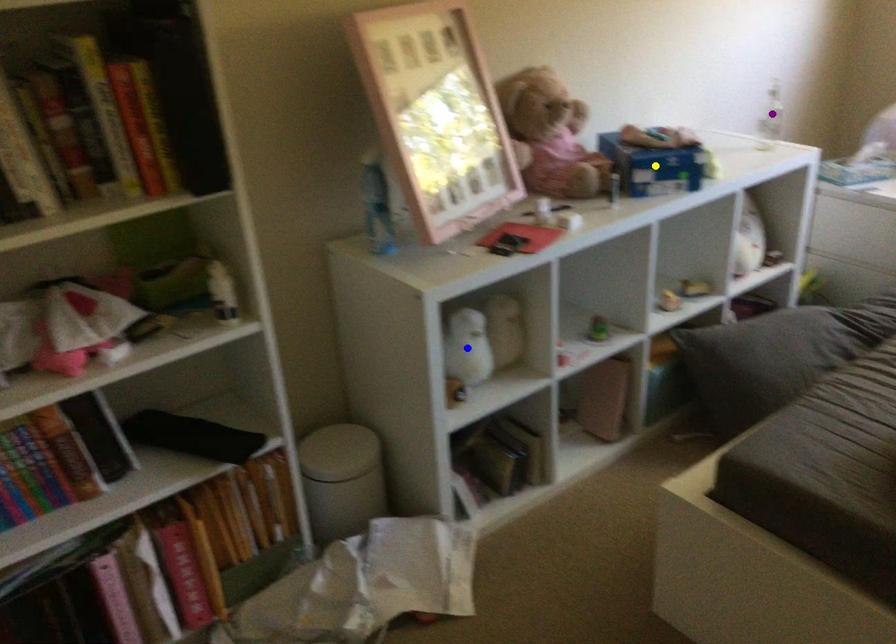
Order these from nearest to farthest:
1. yellow point
2. blue point
3. purple point

blue point → yellow point → purple point